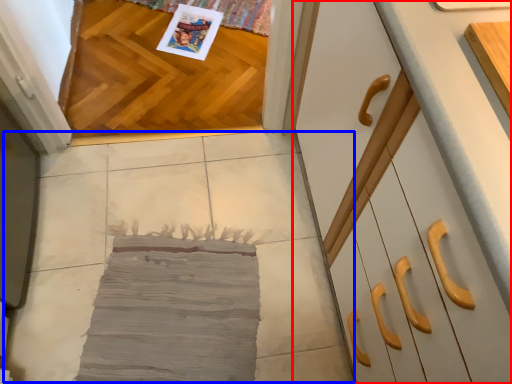
Question: Which point is further to the camera, cabinetry (highlighted by a red box) or concrete (highlighted by a blue box)?

Choices:
 (A) cabinetry
 (B) concrete

Answer: (B)